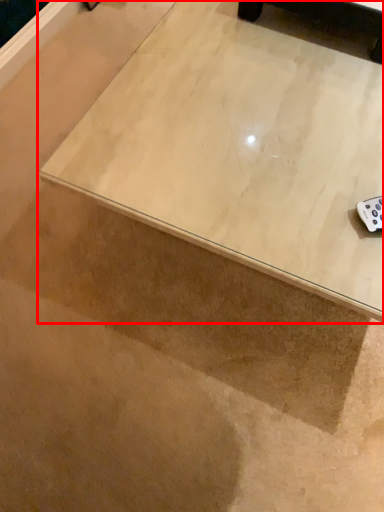
Question: From the image's perspective, what is the correct spatial positioning of table (annotated by the red box) in reference to furniture?

Choices:
 (A) above
 (B) below

Answer: (B)